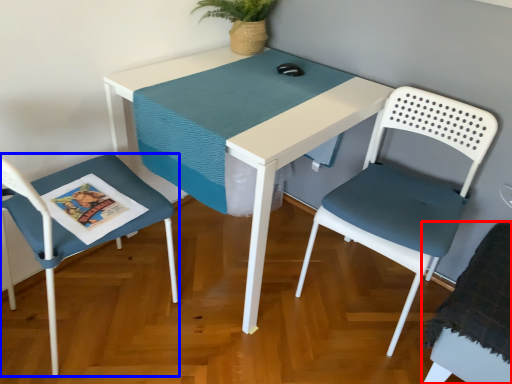
Question: Which of the following is the farthest to the observer, chair (highlighted by a red box) or chair (highlighted by a blue box)?

Choices:
 (A) chair
 (B) chair

Answer: (A)